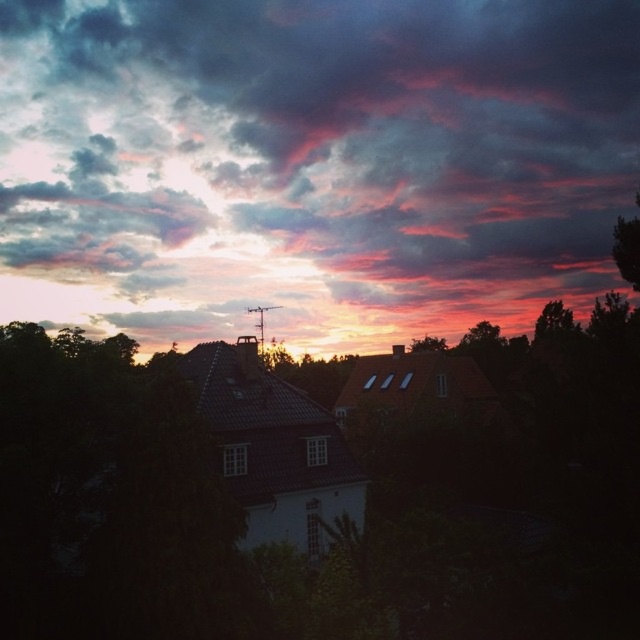
Question: Which object appears closest to the camera in this image?

Choices:
 (A) dark green leafy tree at upper right
 (B) cloudy sky at upper center

Answer: (A)

Question: Which object is positioned closest to the dark green leafy tree at upper right?

Choices:
 (A) green leafy tree at right
 (B) cloudy sky at upper center
 (C) green leafy tree at center

Answer: (A)

Question: Is dark green leafy tree at upper right positioned in front of green leafy tree at right?

Choices:
 (A) yes
 (B) no

Answer: (A)

Question: Does cloudy sky at upper center appear under green leafy tree at center?

Choices:
 (A) yes
 (B) no

Answer: (B)

Question: Does cloudy sky at upper center appear on the left side of dark green leafy tree at upper right?

Choices:
 (A) yes
 (B) no

Answer: (A)

Question: Which is nearer to the green leafy tree at right?

Choices:
 (A) dark green leafy tree at upper right
 (B) green leafy tree at center

Answer: (B)